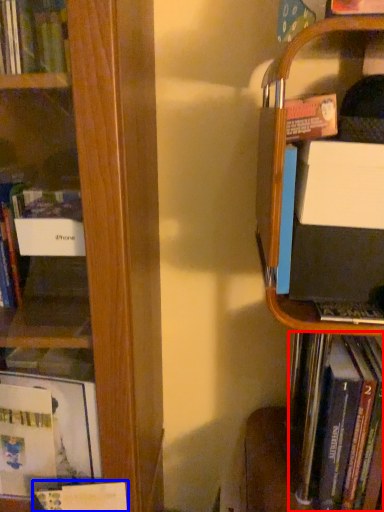
Question: Which object appears closest to the camera in this image, book (highlighted by a red box) or book (highlighted by a blue box)?

Choices:
 (A) book
 (B) book

Answer: (A)